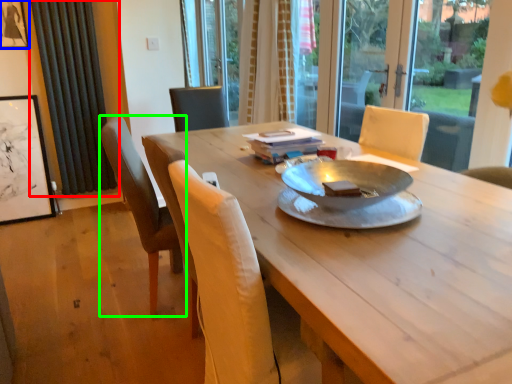
Question: Which object is the farthest from curtain (highlighted by a red box)? Choose among these: picture frame (highlighted by a blue box) or chair (highlighted by a green box).

Choices:
 (A) picture frame
 (B) chair

Answer: (B)